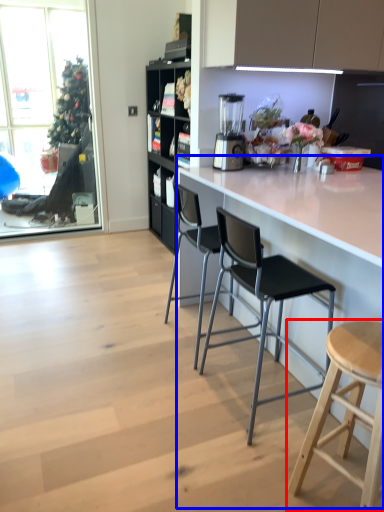
Question: Which object appears closest to the camera in this image, stool (highlighted by a red box) or counter (highlighted by a blue box)?

Choices:
 (A) stool
 (B) counter

Answer: (B)